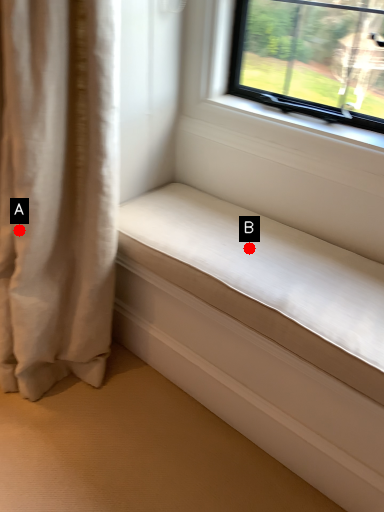
Question: Two points are circled on the image, labeled by A and B beside each circle. Which point appears closest to the camera in this image?

Choices:
 (A) A is closer
 (B) B is closer

Answer: (A)